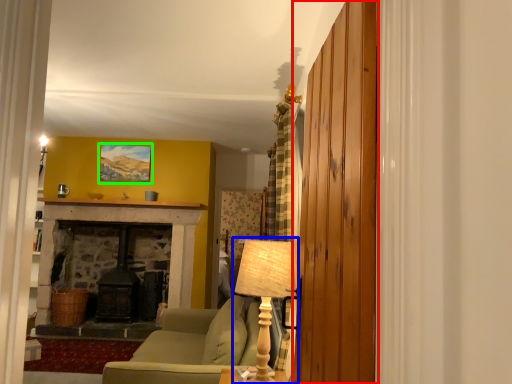
Question: Estimate the real-world distances between objects in this image. Which object is farther from barn door (highlighted by a red box), table lamp (highlighted by a blue box) or picture frame (highlighted by a green box)?

Choices:
 (A) table lamp
 (B) picture frame

Answer: (B)